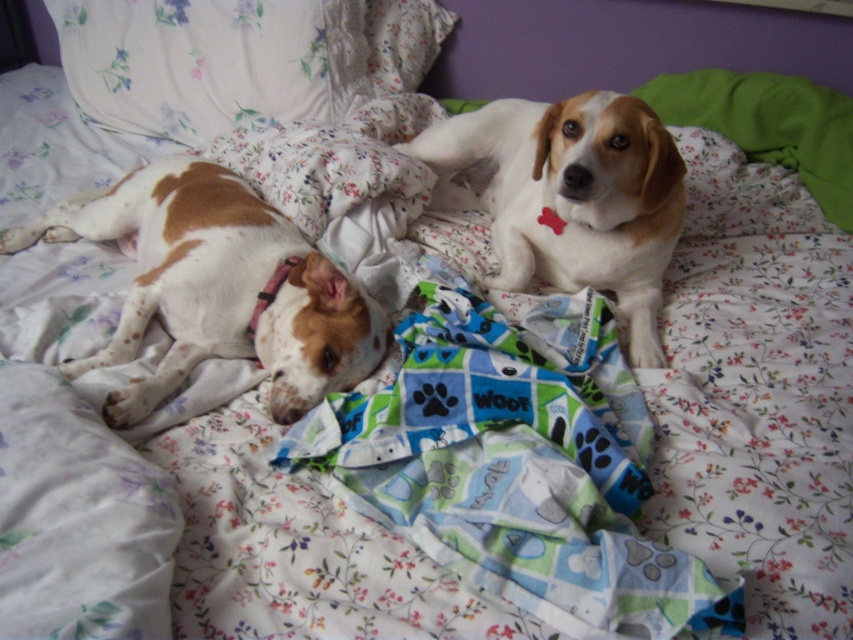
Can you confirm if blue fabric paw print blanket at center is shorter than white soft fur dog at upper right?

Correct, blue fabric paw print blanket at center is not as tall as white soft fur dog at upper right.

The image size is (853, 640). I want to click on blue fabric paw print blanket at center, so click(517, 464).

In the scene shown: Can you confirm if speckled white fur at left is positioned to the right of white soft fur dog at upper right?

No, speckled white fur at left is not to the right of white soft fur dog at upper right.

Does speckled white fur at left have a greater width compared to white soft fur dog at upper right?

Yes.

Does point (113, 237) lie in front of point (670, 150)?

No, it is not.

Locate an element on the screen. The height and width of the screenshot is (640, 853). speckled white fur at left is located at coordinates (218, 288).

Which is in front, point (614, 486) or point (376, 44)?

Point (614, 486) is in front.

At what (x,y) coordinates should I click in order to perform the action: click on blue fabric paw print blanket at center. Please return your answer as a coordinate pair (x, y). This screenshot has height=640, width=853. Looking at the image, I should click on (517, 464).

Which is behind, point (589, 516) or point (189, 138)?

The point (189, 138) is behind.

At what (x,y) coordinates should I click in order to perform the action: click on blue fabric paw print blanket at center. Please return your answer as a coordinate pair (x, y). This screenshot has height=640, width=853. Looking at the image, I should click on (517, 464).